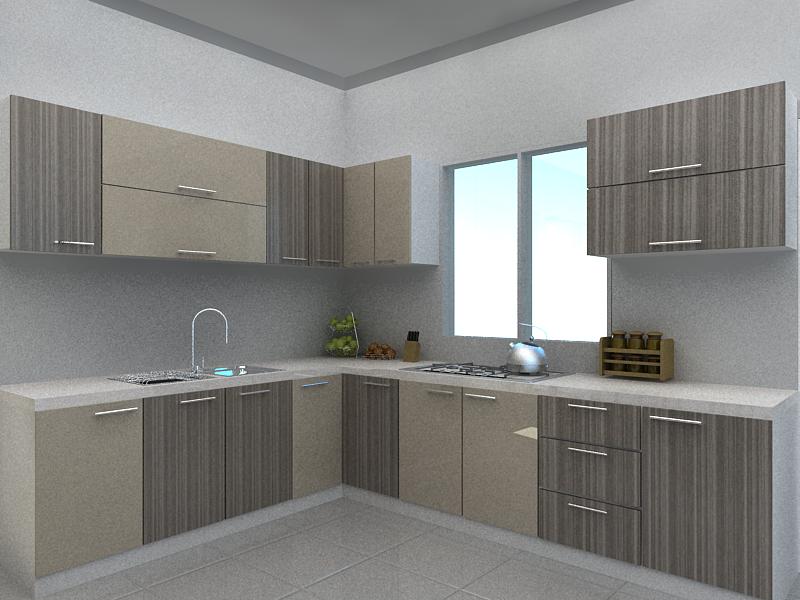
Find the location of a particular element. counter is located at coordinates (689, 397).